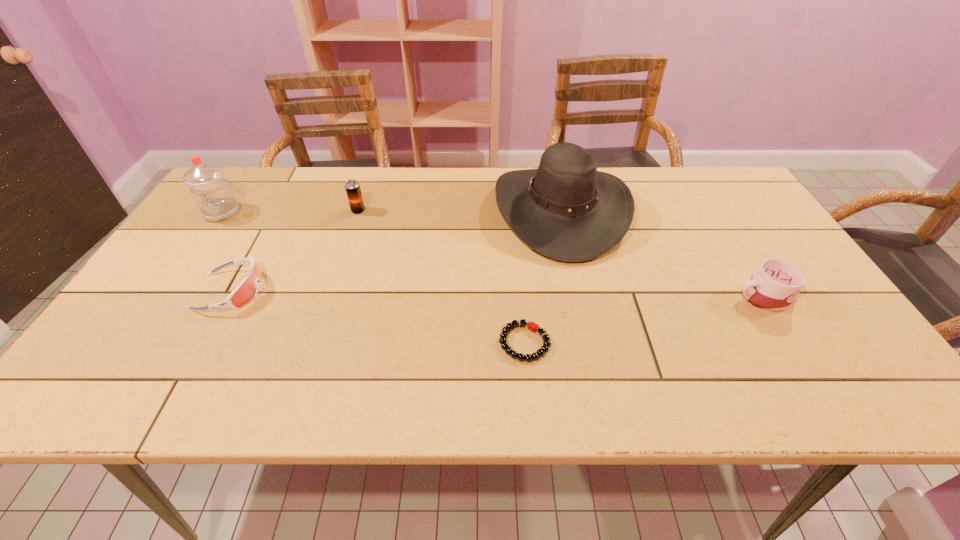
The image size is (960, 540). What are the coordinates of `water bottle that is at the far edge` in the screenshot? It's located at (213, 196).

I want to click on cowboy hat at the far edge, so click(x=566, y=210).

What are the coordinates of `beer can that is positioned at the far edge` in the screenshot? It's located at (352, 187).

The image size is (960, 540). I want to click on water bottle that is positioned at the left edge, so click(x=213, y=196).

Where is `goggles located in the left edge section of the desktop`? This screenshot has width=960, height=540. goggles located in the left edge section of the desktop is located at coordinates (246, 291).

Image resolution: width=960 pixels, height=540 pixels. Find the location of `object that is positioned at the right edge`. object that is positioned at the right edge is located at coordinates (774, 287).

The image size is (960, 540). I want to click on object located at the far left corner, so click(x=213, y=196).

Locate an element on the screen. The image size is (960, 540). free region at the far edge of the desktop is located at coordinates (299, 194).

The height and width of the screenshot is (540, 960). I want to click on free point at the near edge, so click(627, 373).

This screenshot has height=540, width=960. I want to click on vacant space at the left edge, so click(158, 312).